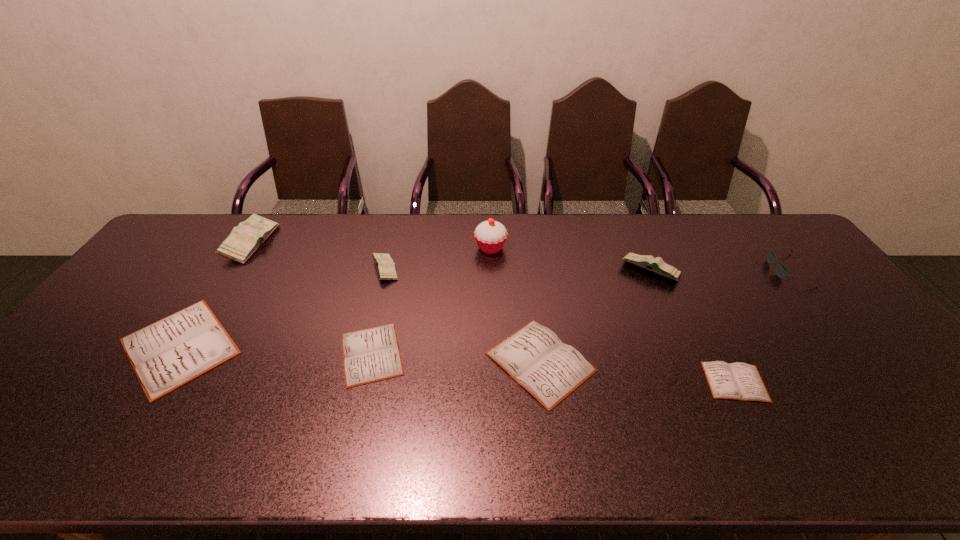
Where is `sunglasses that is at the far edge`? sunglasses that is at the far edge is located at coordinates (782, 271).

The image size is (960, 540). Find the location of `object at the left edge`. object at the left edge is located at coordinates (173, 351).

Find the location of a particular element. This screenshot has height=540, width=960. object that is at the right edge is located at coordinates (782, 271).

What are the coordinates of `object that is at the far right corner` in the screenshot? It's located at (782, 271).

You are a GUI agent. You are given a task and a screenshot of the screen. Output one action in this format:
    pyautogui.click(x=<x>, y=<y>)
    Task: Click on the blank space at the far edge
    This screenshot has height=540, width=960.
    Given the screenshot: What is the action you would take?
    pyautogui.click(x=300, y=229)

Find the location of a particular element. Image resolution: width=960 pixels, height=540 pixels. vacant space at the near edge is located at coordinates (876, 435).

You are a GUI agent. You are given a task and a screenshot of the screen. Output one action in this format:
    pyautogui.click(x=<x>, y=<y>)
    Task: Click on the vacant space at the left edge
    The image size is (960, 540).
    Given the screenshot: What is the action you would take?
    pyautogui.click(x=90, y=334)

This screenshot has width=960, height=540. Identify the location of free location at the far left corner. (222, 218).

Locate an element on the screen. blank area at the far right corner is located at coordinates (791, 246).

Identify the location of empty space between the eighth tallest object and the black sunglasses. (580, 312).